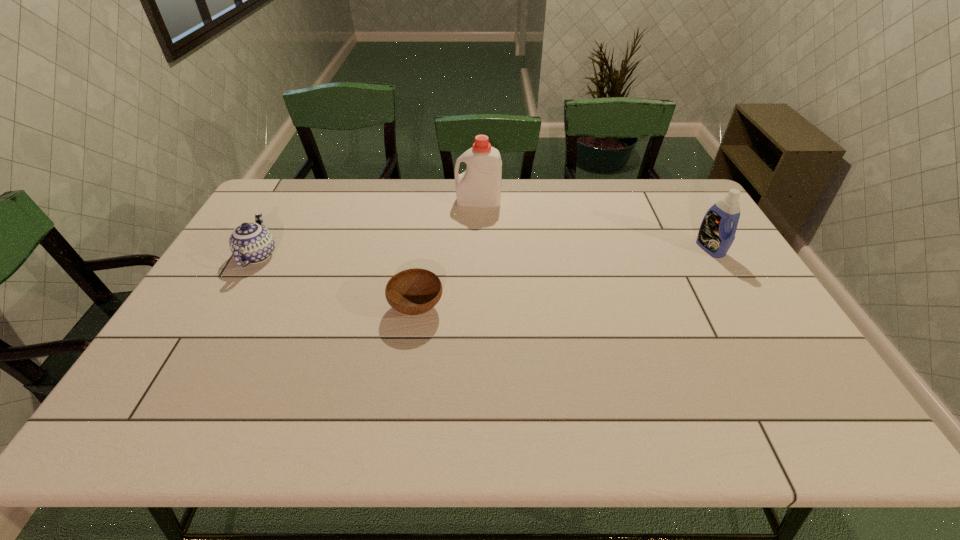
At what (x,y) coordinates should I click in order to perform the action: click on vacant space located 0.330m on the handle side of the third object from left to right. Please return your answer as a coordinate pair (x, y). This screenshot has width=960, height=540. Looking at the image, I should click on (x=363, y=201).

At what (x,y) coordinates should I click in order to perform the action: click on vacant space located 0.190m on the left of the shorter detergent. Please return your answer as a coordinate pair (x, y). Looking at the image, I should click on (636, 248).

Where is `free space located 0.050m at the spout of the leftmost object`? Image resolution: width=960 pixels, height=540 pixels. free space located 0.050m at the spout of the leftmost object is located at coordinates (275, 226).

At what (x,y) coordinates should I click in order to perform the action: click on vacant space situated at the spout of the leftmost object. Please return your answer as a coordinate pair (x, y). The height and width of the screenshot is (540, 960). Looking at the image, I should click on (285, 207).

You are a GUI agent. You are given a task and a screenshot of the screen. Output one action in this format:
    pyautogui.click(x=<x>, y=<y>)
    Task: Click on the free location located at the spout of the leftmost object
    
    Given the screenshot: What is the action you would take?
    pyautogui.click(x=275, y=226)

Locate an element on the screen. The height and width of the screenshot is (540, 960). vacant area situated on the left of the bowl is located at coordinates (337, 308).

Where is `object positioned at the far edge`? The image size is (960, 540). object positioned at the far edge is located at coordinates (479, 185).

At what (x,y) coordinates should I click in order to perform the action: click on object that is at the left edge. Please return your answer as a coordinate pair (x, y). The width and height of the screenshot is (960, 540). Looking at the image, I should click on (252, 243).

Identify the location of object at the right edge. (716, 234).

In the image, there is a desktop. What are the coordinates of `vacant region at the far edge` in the screenshot? It's located at (655, 206).